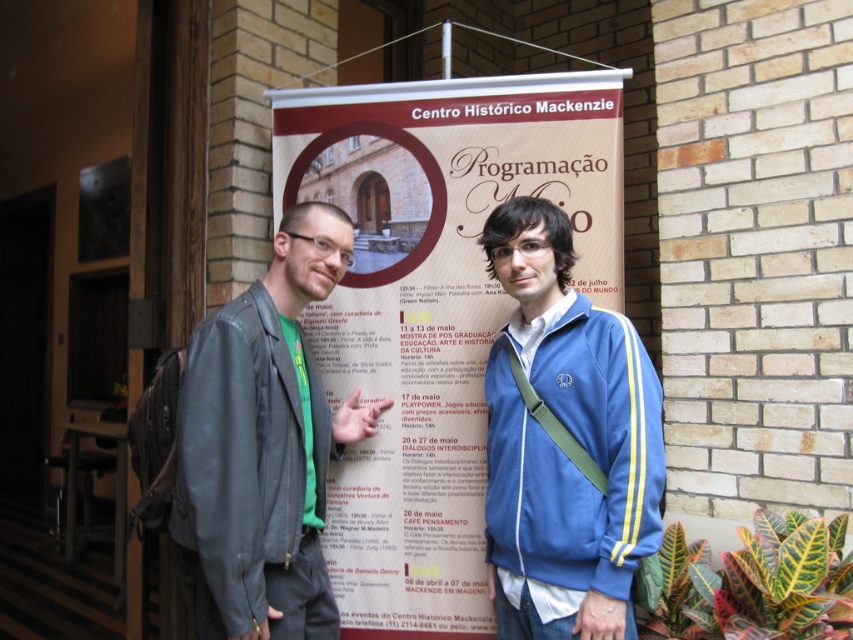
Question: Which point is closer to the camera?

Choices:
 (A) matte paper banner at center
 (B) leather jacket at center
 (C) blue fabric jacket at center

Answer: (C)

Question: Which of the following is the closest to the observer?

Choices:
 (A) leather jacket at center
 (B) matte paper banner at center

Answer: (A)

Question: Can you confirm if matte paper banner at center is positioned above leather jacket at center?

Choices:
 (A) yes
 (B) no

Answer: (A)

Question: Can you confirm if matte paper banner at center is positioned to the left of blue fabric jacket at center?

Choices:
 (A) no
 (B) yes

Answer: (B)

Question: Can you confirm if matte paper banner at center is smaller than blue fabric jacket at center?

Choices:
 (A) no
 (B) yes

Answer: (A)

Question: Which is farther from the matte paper banner at center?

Choices:
 (A) blue fabric jacket at center
 (B) leather jacket at center

Answer: (A)